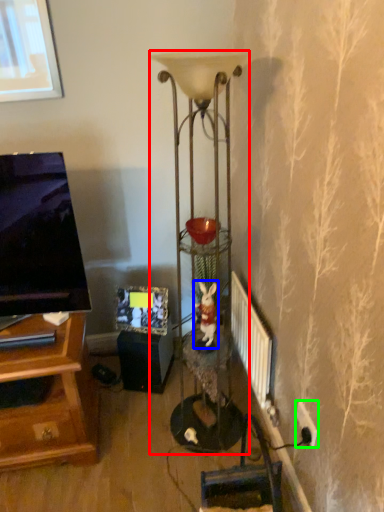
Question: Which is nearer to the lamp (highlighted by a red box)? animal (highlighted by a blue box) or electric outlet (highlighted by a green box).

Choices:
 (A) animal
 (B) electric outlet

Answer: (A)